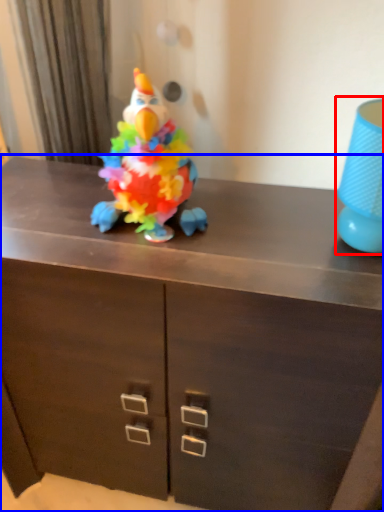
Question: Among these objects, which one is farthest to the camera, lamp (highlighted by a red box) or chest of drawers (highlighted by a blue box)?

Choices:
 (A) lamp
 (B) chest of drawers

Answer: (B)